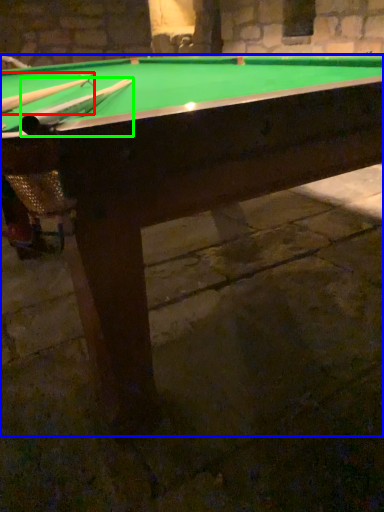
Question: Which object is positioned closest to cue (highlighted by a red box)? Select from billiard table (highlighted by a blue box) and cue (highlighted by a green box).

Choices:
 (A) billiard table
 (B) cue

Answer: (B)